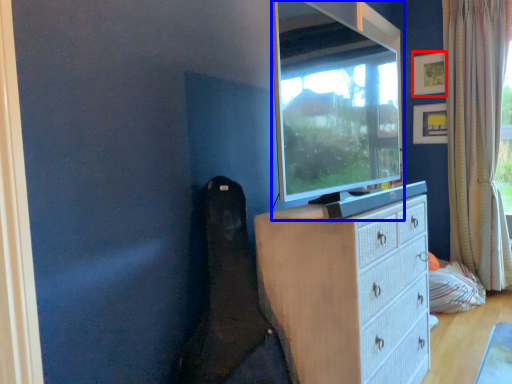
Question: Which object appears farthest to the camera in this image, picture frame (highlighted by a red box) or television (highlighted by a blue box)?

Choices:
 (A) picture frame
 (B) television

Answer: (A)